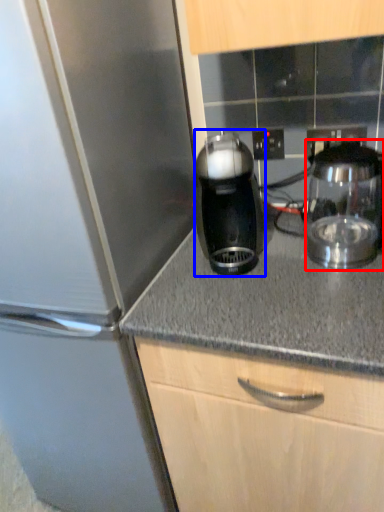
Question: Which of the following is the closest to the observer, kitchen appliance (highlighted by a red box) or kitchen appliance (highlighted by a blue box)?

Choices:
 (A) kitchen appliance
 (B) kitchen appliance

Answer: (A)